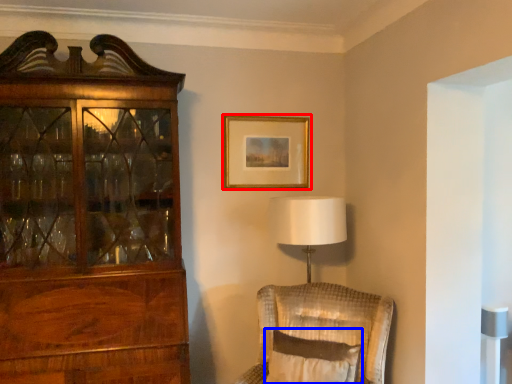
Question: Which object is further to the camera taking this photo, picture frame (highlighted by a red box) or pillow (highlighted by a blue box)?

Choices:
 (A) picture frame
 (B) pillow

Answer: (A)